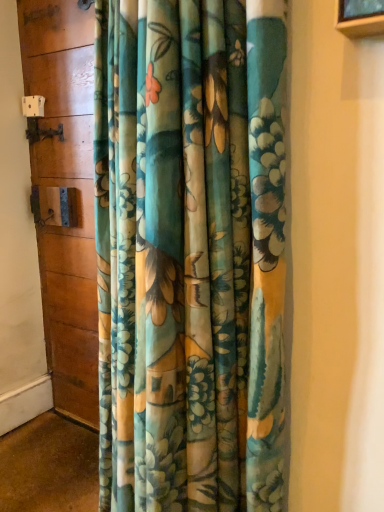
Image resolution: width=384 pixels, height=512 pixels. I want to click on vacant space situated on the left part of wooden door at left, so click(x=37, y=438).